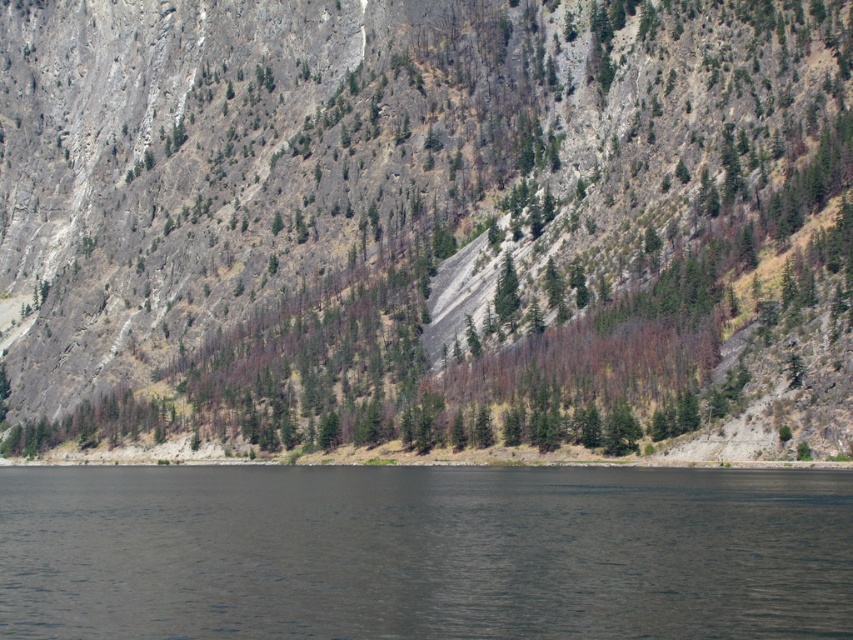
Question: Can you confirm if rocky cliff at center is positioned to the left of dark gray water at lower center?

Choices:
 (A) no
 (B) yes

Answer: (B)

Question: Can you confirm if rocky cliff at center is thinner than dark gray water at lower center?

Choices:
 (A) no
 (B) yes

Answer: (A)

Question: Can you confirm if rocky cliff at center is positioned below dark gray water at lower center?

Choices:
 (A) no
 (B) yes

Answer: (A)

Question: Among these objects, which one is nearest to the camera?

Choices:
 (A) dark gray water at lower center
 (B) rocky cliff at center

Answer: (A)